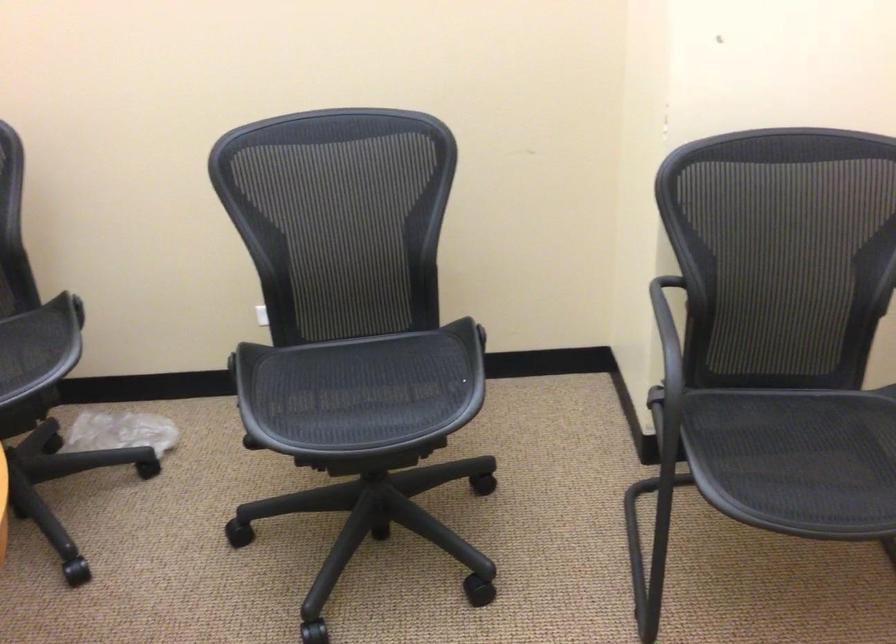
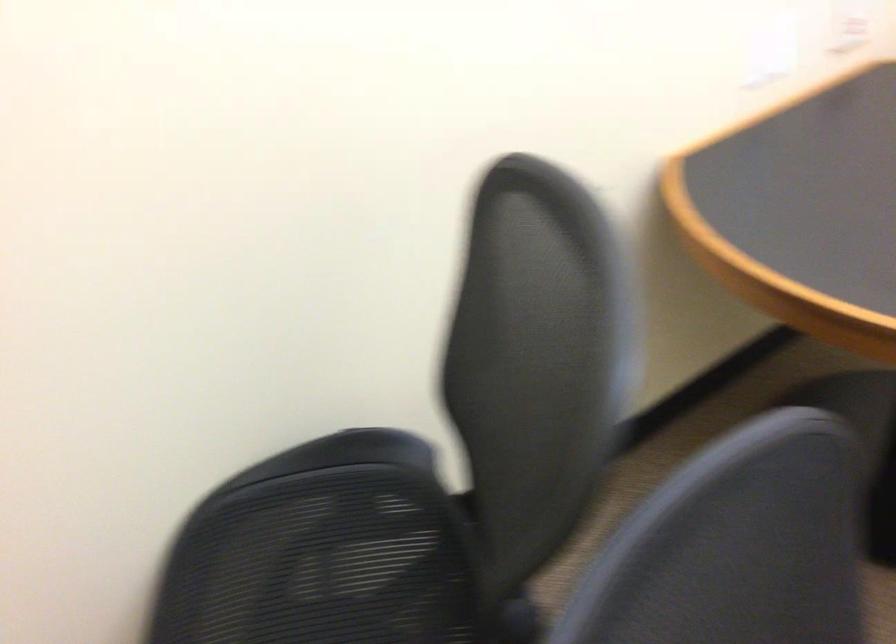
In the scene shown: Based on the continuous images, in which direction is the camera rotating?

The camera's rotation is toward left-down.